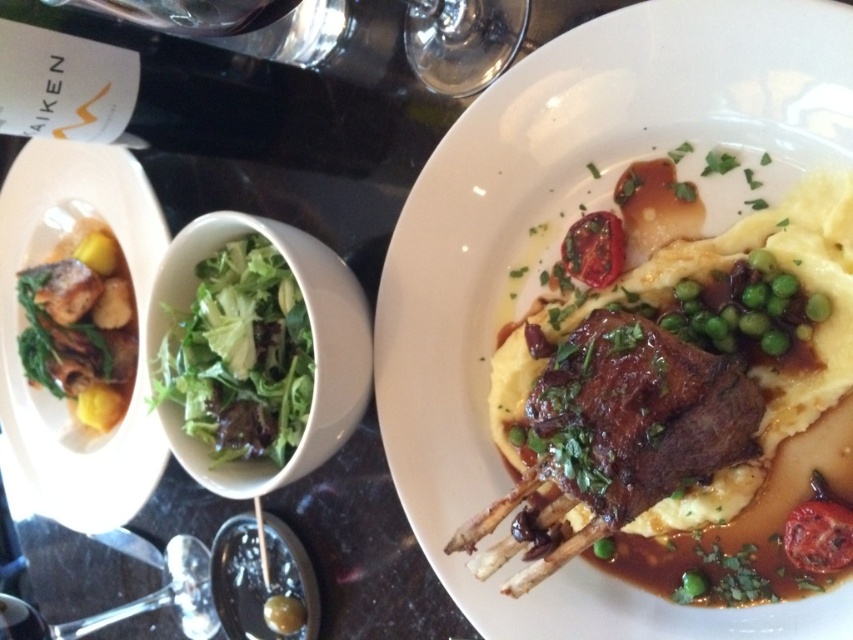
What are the coordinates of the brown glazed lamb chop at center?

The brown glazed lamb chop at center is located at coordinates point (573, 220).

You are a food critic evaluating the presentation of this dish. Considering the size difference between the brown glazed lamb chop at center and the transparent glass at upper center, which one do you think is more visually dominant in the composition?

The brown glazed lamb chop at center is more visually dominant because it has a larger size compared to the transparent glass at upper center.